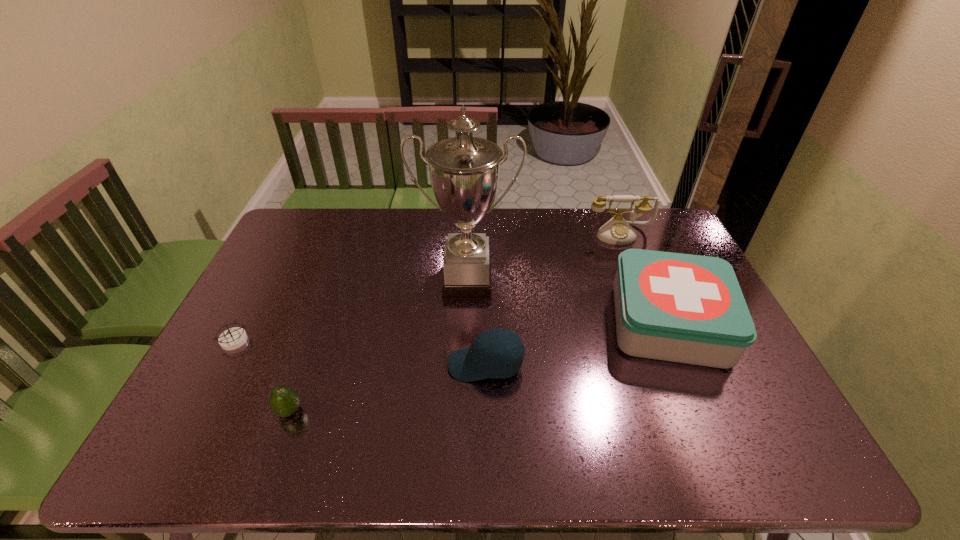
In order to click on object located at the far right corner in this screenshot , I will do `click(617, 231)`.

Locate an element on the screen. This screenshot has width=960, height=540. vacant space at the far edge is located at coordinates (355, 235).

In the image, there is a desktop. At what (x,y) coordinates should I click in order to perform the action: click on vacant space at the near edge. Please return your answer as a coordinate pair (x, y). Looking at the image, I should click on (457, 456).

At what (x,y) coordinates should I click in order to perform the action: click on blank space at the left edge of the desktop. Please return your answer as a coordinate pair (x, y). The height and width of the screenshot is (540, 960). Looking at the image, I should click on (193, 412).

In the image, there is a desktop. In order to click on vacant region at the right edge in this screenshot , I will do `click(745, 402)`.

At what (x,y) coordinates should I click in order to perform the action: click on vacant space at the near left corner. Please return your answer as a coordinate pair (x, y). The width and height of the screenshot is (960, 540). Looking at the image, I should click on (163, 447).

In the image, there is a desktop. Find the location of `vacant space at the far right corner`. vacant space at the far right corner is located at coordinates (660, 211).

The image size is (960, 540). In order to click on free area in between the nearest object and the baseball cap in this screenshot , I will do `click(388, 388)`.

This screenshot has width=960, height=540. Find the location of `unoccupied position between the compass and the baseball cap`. unoccupied position between the compass and the baseball cap is located at coordinates (x=360, y=353).

This screenshot has height=540, width=960. I want to click on free space that is in between the third shortest object and the farthest object, so click(553, 299).